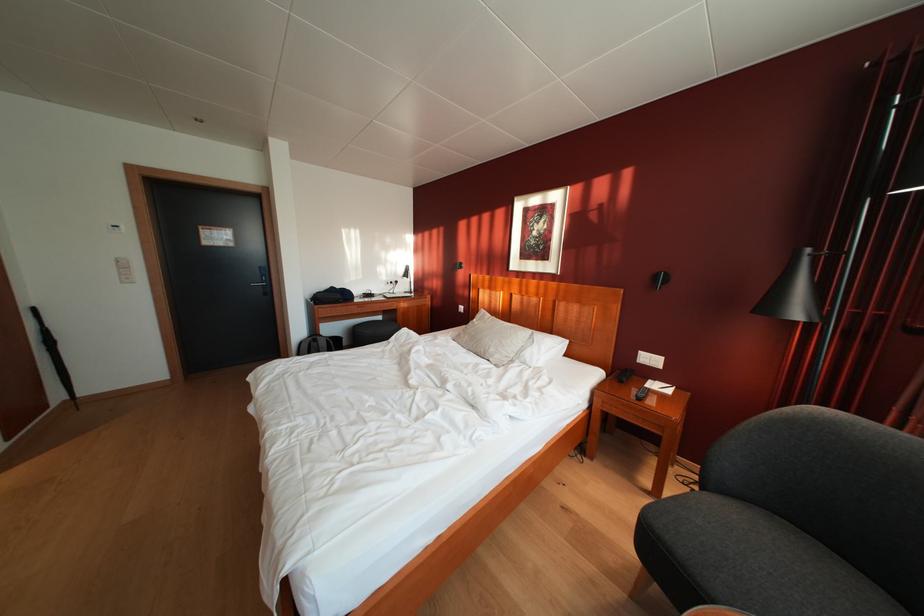
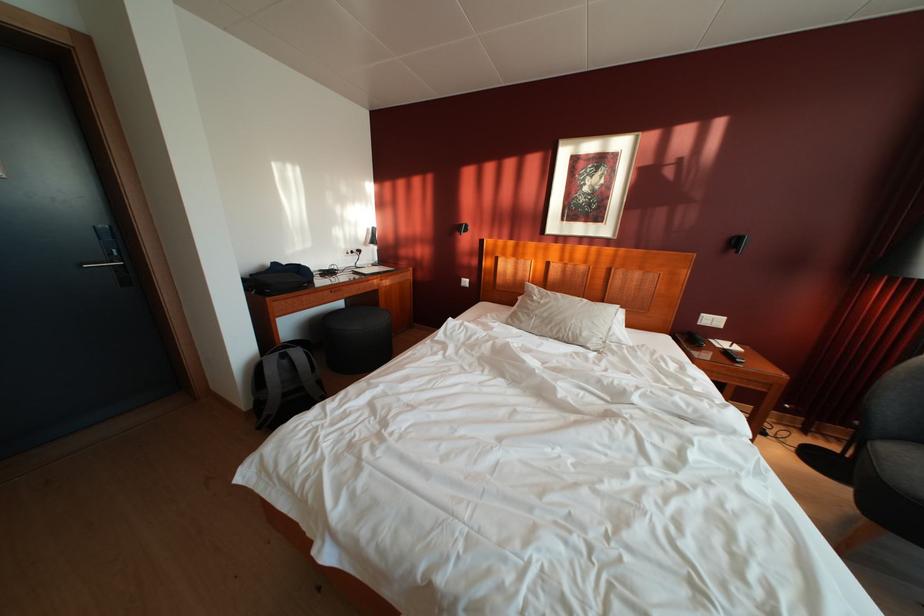
Find the pixel in the second image that matches point 323,346 in the first image.

(293, 362)